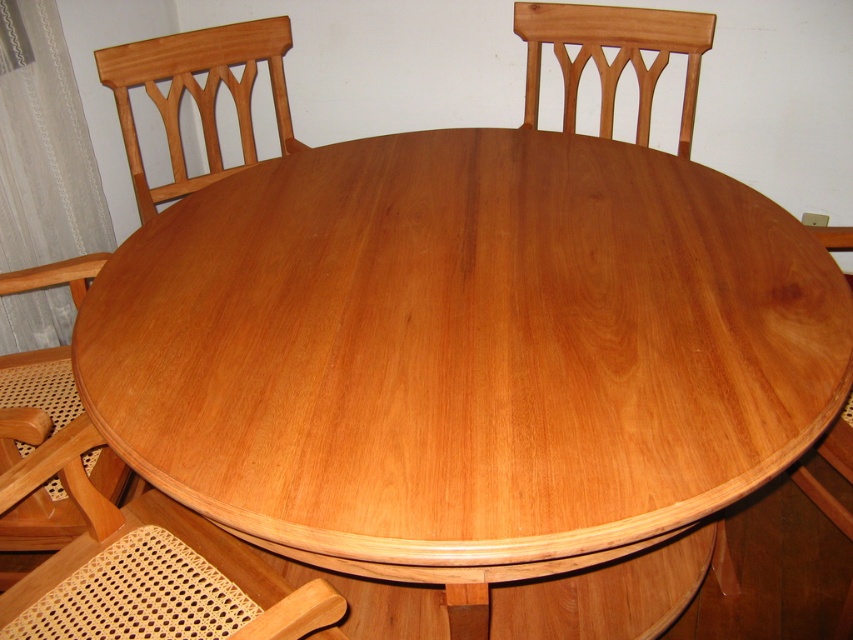
You are sitting at the wooden dining table and want to pass a plate to the person sitting at the light brown wood chair at upper left and the light brown wood chair at lower left. Which chair is positioned higher up in the image?

The light brown wood chair at upper left is positioned higher up in the image compared to the light brown wood chair at lower left.